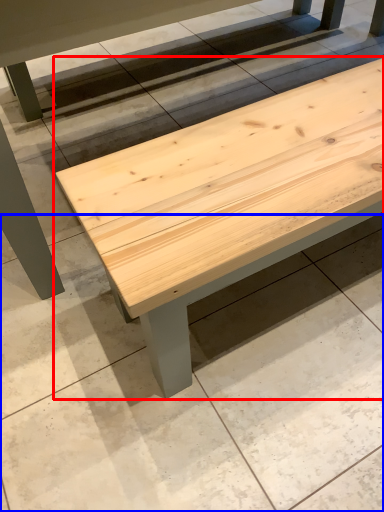
Question: Among these objects, which one is nearest to the camera, table (highlighted by a red box) or concrete (highlighted by a blue box)?

Choices:
 (A) table
 (B) concrete

Answer: (A)